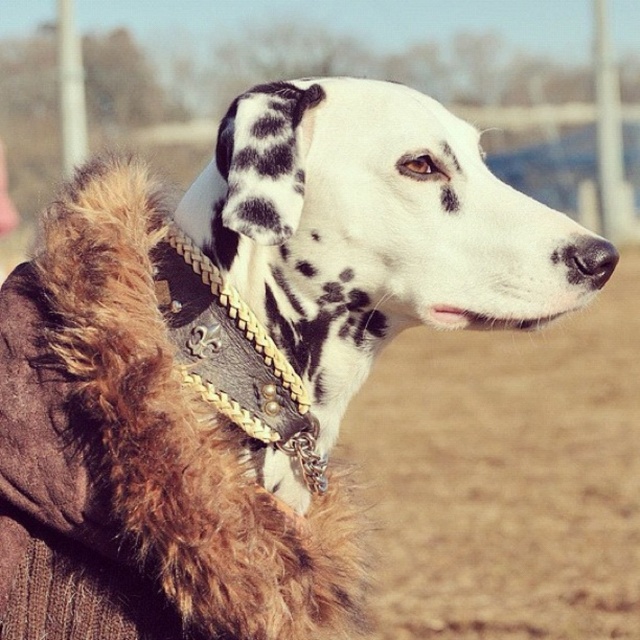
You are a photographer adjusting your camera to focus on two points in the image. The first point is point (637, 349) and the second is point (214, 292). Which point is closer to your camera lens?

Point (637, 349) is further to the viewer than point (214, 292), so the second point is closer to the camera lens.

You are standing at the position of the Dalmatian dog in the image. Which direction should you look to see the brown dirt field at lower right located at point (508, 476)?

The brown dirt field at lower right is located at point (508, 476), so you should look towards the lower right direction to see it.